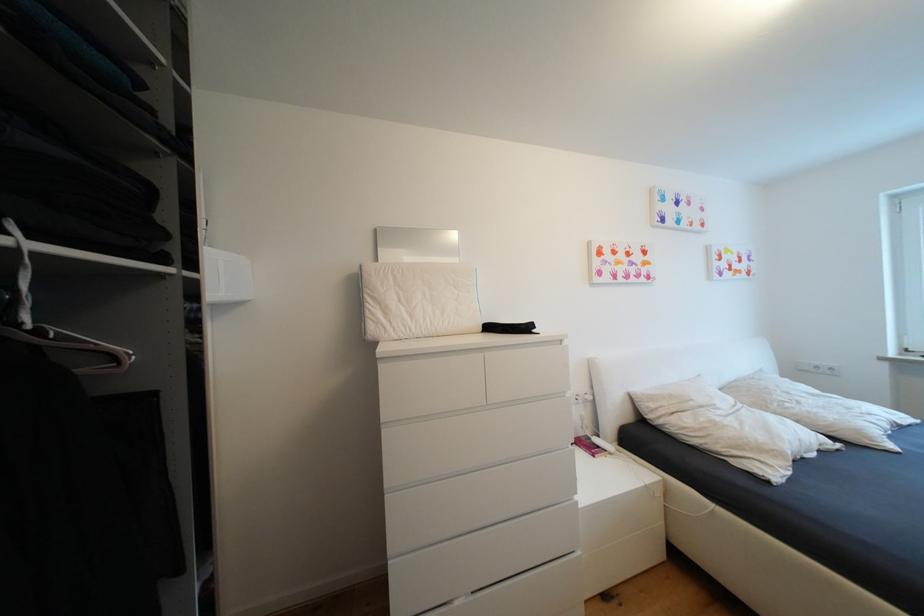
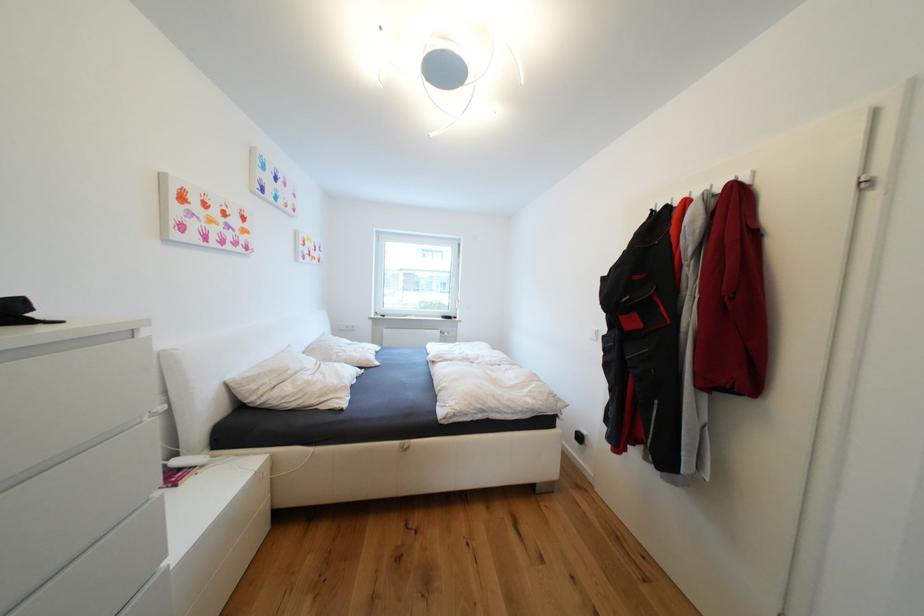
Locate, in the second image, the point that corresponds to point 602,442 in the first image.

(184, 464)